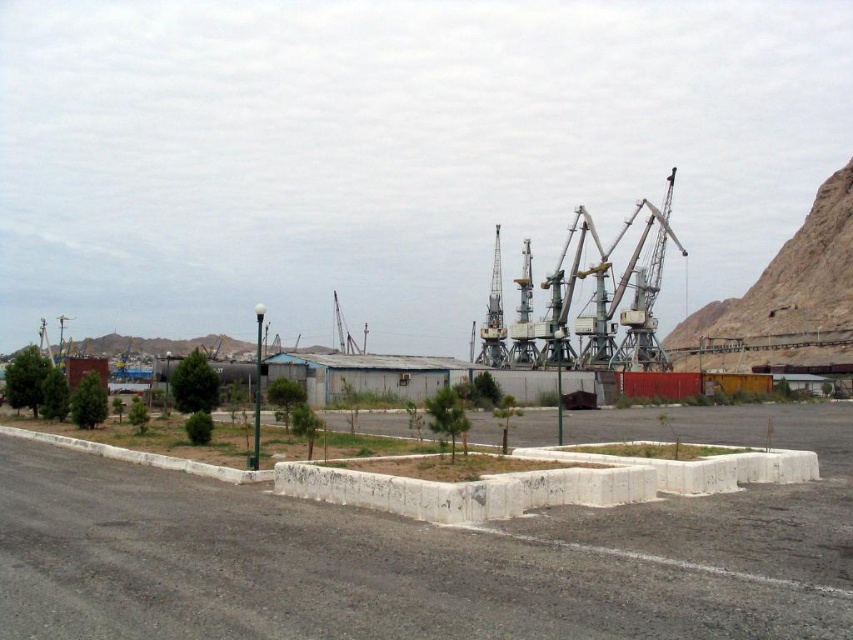
Question: In this image, where is concrete at center located relative to white concrete curb at center?

Choices:
 (A) below
 (B) above

Answer: (A)

Question: Which of the following is the closest to the observer?

Choices:
 (A) concrete at center
 (B) white concrete curb at center

Answer: (A)

Question: Does concrete at center appear on the left side of white concrete curb at center?

Choices:
 (A) yes
 (B) no

Answer: (A)

Question: Can you confirm if concrete at center is wider than white concrete curb at center?

Choices:
 (A) no
 (B) yes

Answer: (B)